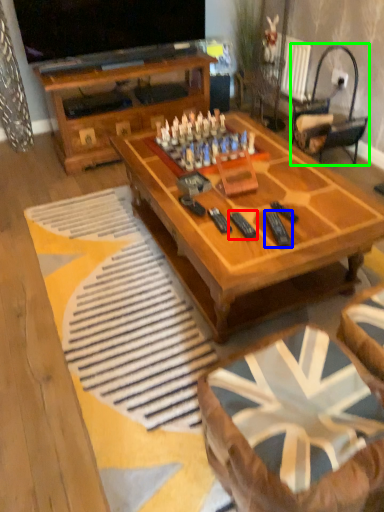
Question: Estimate the real-world distances between objects in this image. Which object is closer to remote (highlighted by a red box), remote (highlighted by a blue box) or rocking chair (highlighted by a green box)?

Choices:
 (A) remote
 (B) rocking chair

Answer: (A)